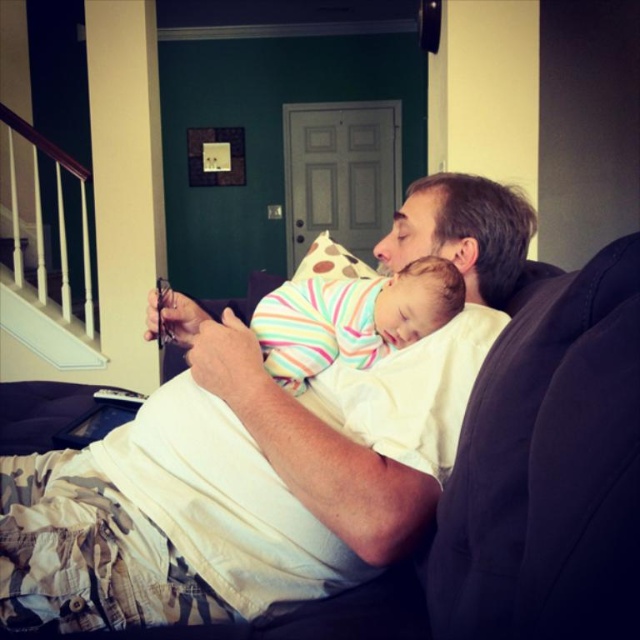
Question: Can you confirm if white cotton shirt at center is smaller than striped cotton onesie at center?

Choices:
 (A) yes
 (B) no

Answer: (B)

Question: In this image, where is white cotton shirt at center located relative to striped cotton onesie at center?

Choices:
 (A) right
 (B) left

Answer: (B)

Question: Is white cotton shirt at center above striped cotton onesie at center?

Choices:
 (A) no
 (B) yes

Answer: (A)